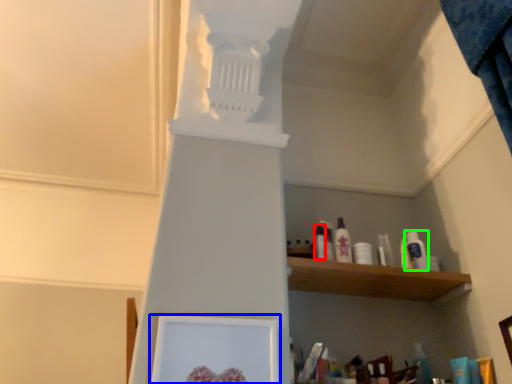
Question: Considering the real-world distances, which object is closest to toiletry (highlighted by a red box)? picture frame (highlighted by a blue box) or toiletry (highlighted by a green box).

Choices:
 (A) picture frame
 (B) toiletry

Answer: (B)